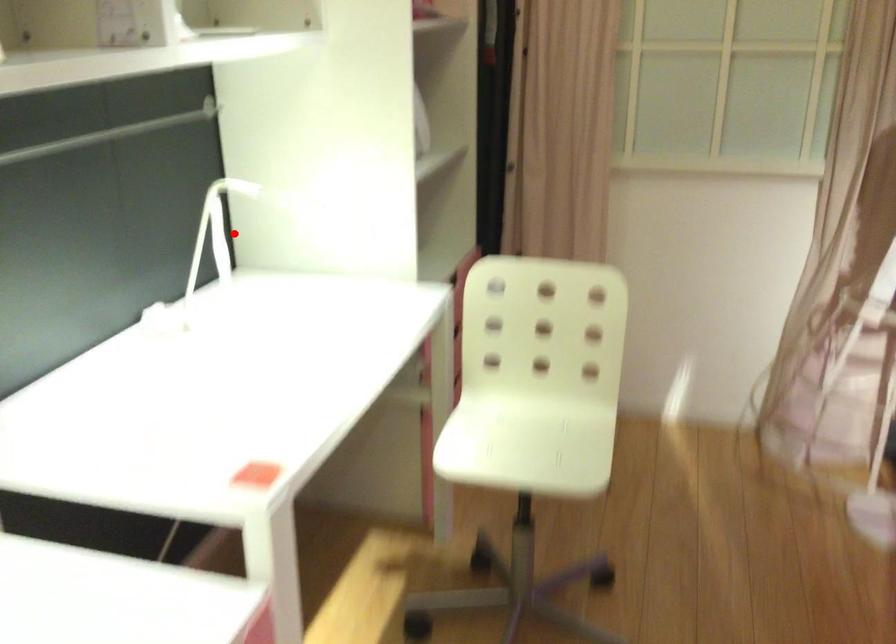
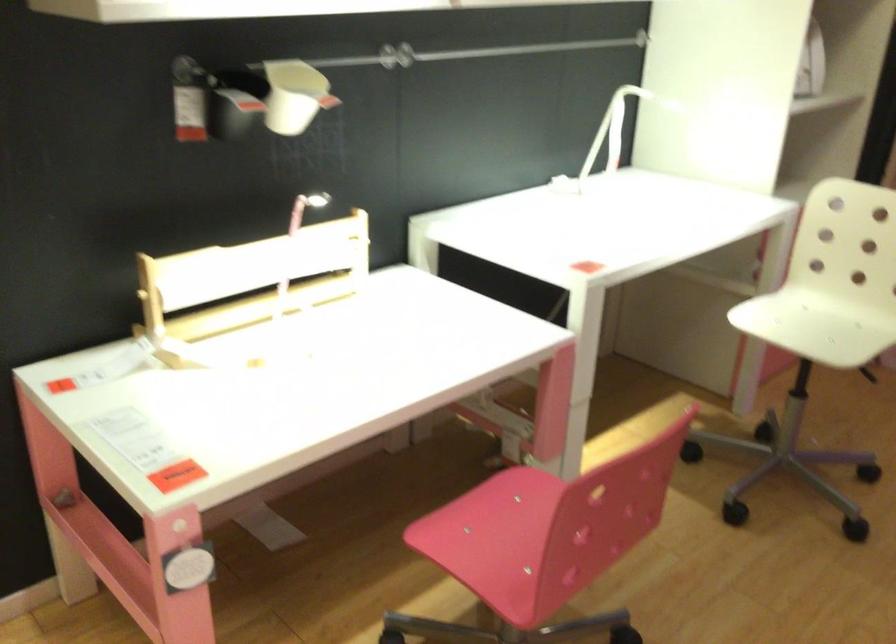
Question: I am providing you with two images of the same scene from different viewpoints. Image1 has a red point marked. In image2, the corresponding 3D location appears at what relative position? Reply with the corresponding letter.

Choices:
 (A) Closer
 (B) Farther

Answer: (B)